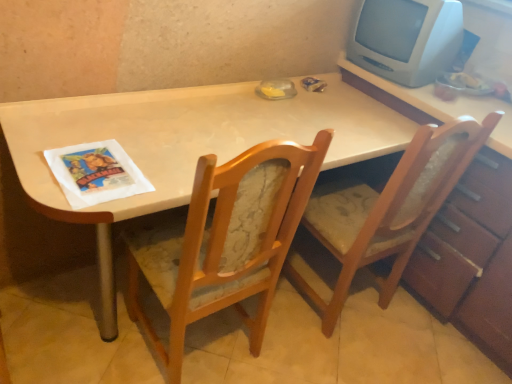
Question: Is white paper magazine at left spatially inside wooden table at center, or outside of it?

Choices:
 (A) inside
 (B) outside

Answer: (A)

Question: From the image's perspective, is white paper magazine at left located above or below wooden table at center?

Choices:
 (A) above
 (B) below

Answer: (A)

Question: Which object is the closest to the white paper magazine at left?

Choices:
 (A) wooden dresser at right
 (B) wooden textured chair at right, acting as the 1th chair starting from the right
 (C) wooden table at center
 (D) wooden chair with fabric cushion at center, the second chair positioned from the right
 (E) white plastic monitor at upper right

Answer: (C)

Question: Which of these objects is positioned farthest from the wooden textured chair at right, acting as the 1th chair starting from the right?

Choices:
 (A) white paper magazine at left
 (B) wooden dresser at right
 (C) wooden table at center
 (D) white plastic monitor at upper right
 (E) wooden chair with fabric cushion at center, acting as the 1th chair starting from the left

Answer: (A)